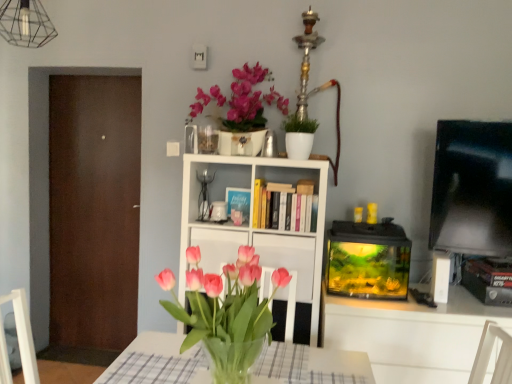
What is the approximate width of white matte bookcase at center?

16.75 inches.

Measure the distance between point (224, 211) and camera.

2.45 meters.

Describe the element at coordinates (226, 312) in the screenshot. I see `pink glass vase at center` at that location.

At what (x,y) coordinates should I click in order to perform the action: click on matte ceramic vase at upper center. Please return your answer as a coordinate pair (x, y). Image resolution: width=512 pixels, height=384 pixels. Looking at the image, I should click on (242, 100).

Between point (281, 244) and point (219, 349), which one is positioned in front?

The point (219, 349) is closer to the camera.

From the image's perspective, relative to pink glass vase at center, is white glossy cabinet at center above or below?

Clearly, from the image's perspective, white glossy cabinet at center is above pink glass vase at center.

Is pink glass vase at center surrounded by white glossy cabinet at center?

Definitely not — pink glass vase at center is not inside white glossy cabinet at center.

Considering the sizes of white glossy cabinet at center and pink glass vase at center in the image, is white glossy cabinet at center taller or shorter than pink glass vase at center?

white glossy cabinet at center is shorter than pink glass vase at center.

Is brown matte door at left facing away from matte ceramic vase at upper center?

No, matte ceramic vase at upper center is not at the back of brown matte door at left.

Is brown matte door at left at the right side of matte ceramic vase at upper center?

Incorrect, brown matte door at left is not on the right side of matte ceramic vase at upper center.

Is the depth of brown matte door at left greater than that of matte ceramic vase at upper center?

Yes, brown matte door at left is behind matte ceramic vase at upper center.

Which of these two, brown matte door at left or matte ceramic vase at upper center, is bigger?

brown matte door at left is bigger.

Between brown matte door at left and pink glass vase at center, which one appears on the left side from the viewer's perspective?

From the viewer's perspective, brown matte door at left appears more on the left side.

Does point (72, 100) lie behind point (234, 360)?

Yes, point (72, 100) is farther from viewer.

What's the angular difference between brown matte door at left and pink glass vase at center's facing directions?

The angle between the facing direction of brown matte door at left and the facing direction of pink glass vase at center is 1.89 degrees.

Can you tell me how much white matte bookcase at center and brown matte door at left differ in facing direction?

There is a 2.55-degree angle between the facing directions of white matte bookcase at center and brown matte door at left.

Identify the location of door behind the white matte bookcase at center. (94, 210).

Which is behind, white matte bookcase at center or brown matte door at left?

brown matte door at left is further from the camera.

From a real-world perspective, relative to brown matte door at left, is white matte bookcase at center vertically above or below?

white matte bookcase at center is situated lower than brown matte door at left in the real world.

Between pink glass vase at center and white glossy mug at center, which one is positioned in front?

pink glass vase at center is more forward.

Which of these two, pink glass vase at center or white glossy mug at center, stands taller?

With more height is pink glass vase at center.

From a real-world perspective, is pink glass vase at center positioned above or below white glossy mug at center?

pink glass vase at center is below white glossy mug at center.

Is pink glass vase at center positioned with its back to white matte bookcase at center?

Yes.

In the image, is pink glass vase at center on the left side or the right side of white matte bookcase at center?

pink glass vase at center is positioned on white matte bookcase at center's left side.

Considering the points (231, 370) and (214, 256), which point is behind, point (231, 370) or point (214, 256)?

Point (214, 256)

Is pink glass vase at center placed right next to white matte bookcase at center?

No.

How many degrees apart are the facing directions of white matte bookcase at center and white glossy mug at center?

white matte bookcase at center and white glossy mug at center are facing 9.99 degrees away from each other.

Considering the sizes of white matte bookcase at center and white glossy mug at center in the image, is white matte bookcase at center taller or shorter than white glossy mug at center?

In the image, white matte bookcase at center appears to be taller than white glossy mug at center.

Is white matte bookcase at center thinner than white glossy mug at center?

No, white matte bookcase at center is not thinner than white glossy mug at center.

Could you tell me if white matte bookcase at center is facing white glossy mug at center?

Yes, white matte bookcase at center is oriented towards white glossy mug at center.

Locate an element on the screen. This screenshot has height=384, width=512. houseplant below the white glossy cabinet at center (from the image's perspective) is located at coordinates (226, 312).

Locate an element on the screen. flower located above the brown matte door at left (from the image's perspective) is located at coordinates (242, 100).

Based on their spatial positions, is white matte bookcase at center or white glossy cabinet at center closer to white glossy mug at center?

white matte bookcase at center lies closer to white glossy mug at center than the other object.

Considering their positions, is brown matte door at left positioned further to pink glass vase at center than matte ceramic vase at upper center?

brown matte door at left lies further to pink glass vase at center than the other object.

Looking at the image, which one is located further to pink glass vase at center, white glossy cabinet at center or white matte bookcase at center?

Based on the image, white glossy cabinet at center appears to be further to pink glass vase at center.

Considering their positions, is white matte bookcase at center positioned closer to brown matte door at left than white glossy cabinet at center?

white matte bookcase at center is positioned closer to the anchor brown matte door at left.

Based on their spatial positions, is pink glass vase at center or brown matte door at left closer to white glossy mug at center?

Based on the image, pink glass vase at center appears to be nearer to white glossy mug at center.

When comparing their distances from white matte bookcase at center, does pink glass vase at center or white glossy cabinet at center seem closer?

white glossy cabinet at center.

Considering their positions, is brown matte door at left positioned closer to matte ceramic vase at upper center than pink glass vase at center?

The object closer to matte ceramic vase at upper center is brown matte door at left.

Based on their spatial positions, is white glossy mug at center or white glossy cabinet at center closer to matte ceramic vase at upper center?

white glossy mug at center lies closer to matte ceramic vase at upper center than the other object.

The width and height of the screenshot is (512, 384). Identify the location of cabinet positioned between pink glass vase at center and matte ceramic vase at upper center from near to far. (289, 258).

I want to click on tableware between brown matte door at left and white matte bookcase at center from left to right, so click(x=218, y=211).

At what (x,y) coordinates should I click in order to perform the action: click on bookcase between white glossy mug at center and white glossy cabinet at center in the horizontal direction. Please return your answer as a coordinate pair (x, y). Looking at the image, I should click on (251, 223).

This screenshot has height=384, width=512. Identify the location of bookcase between matte ceramic vase at upper center and white glossy cabinet at center in the vertical direction. (251, 223).